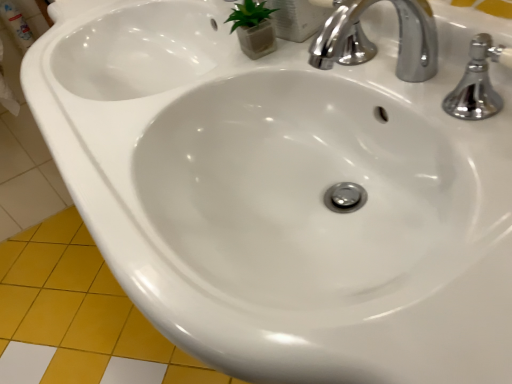
Question: Can you confirm if polished chrome faucet at upper right is shorter than yellow matte tile at lower left?

Choices:
 (A) yes
 (B) no

Answer: (B)

Question: Is polished chrome faucet at upper right facing away from yellow matte tile at lower left?

Choices:
 (A) yes
 (B) no

Answer: (B)

Question: Considering the relative sizes of polished chrome faucet at upper right and yellow matte tile at lower left in the image provided, is polished chrome faucet at upper right bigger than yellow matte tile at lower left?

Choices:
 (A) yes
 (B) no

Answer: (B)

Question: Is polished chrome faucet at upper right thinner than yellow matte tile at lower left?

Choices:
 (A) no
 (B) yes

Answer: (B)

Question: From the image's perspective, would you say polished chrome faucet at upper right is positioned over yellow matte tile at lower left?

Choices:
 (A) yes
 (B) no

Answer: (A)

Question: Can yellow matte tile at lower left be found inside polished chrome faucet at upper right?

Choices:
 (A) yes
 (B) no

Answer: (B)

Question: From the image's perspective, is yellow matte tile at lower left on polished chrome faucet at upper right?

Choices:
 (A) no
 (B) yes

Answer: (A)

Question: Considering the relative sizes of yellow matte tile at lower left and polished chrome faucet at upper right in the image provided, is yellow matte tile at lower left bigger than polished chrome faucet at upper right?

Choices:
 (A) yes
 (B) no

Answer: (A)

Question: Is yellow matte tile at lower left wider than polished chrome faucet at upper right?

Choices:
 (A) yes
 (B) no

Answer: (A)

Question: Considering the relative sizes of yellow matte tile at lower left and polished chrome faucet at upper right in the image provided, is yellow matte tile at lower left thinner than polished chrome faucet at upper right?

Choices:
 (A) yes
 (B) no

Answer: (B)

Question: Is polished chrome faucet at upper right located within yellow matte tile at lower left?

Choices:
 (A) yes
 (B) no

Answer: (B)

Question: Does yellow matte tile at lower left have a greater height compared to polished chrome faucet at upper right?

Choices:
 (A) yes
 (B) no

Answer: (B)

Question: Do you think yellow matte tile at lower left is within polished chrome faucet at upper right, or outside of it?

Choices:
 (A) outside
 (B) inside

Answer: (A)